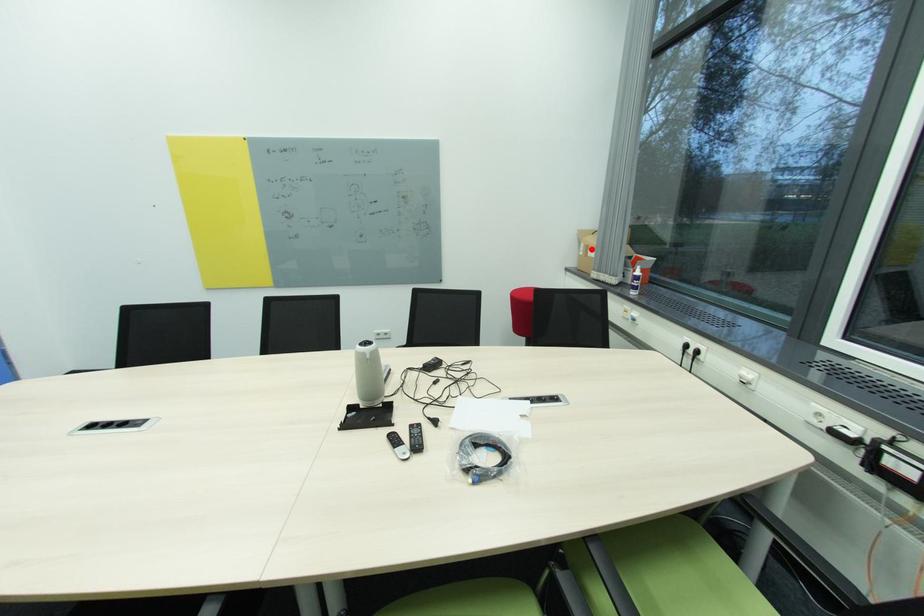
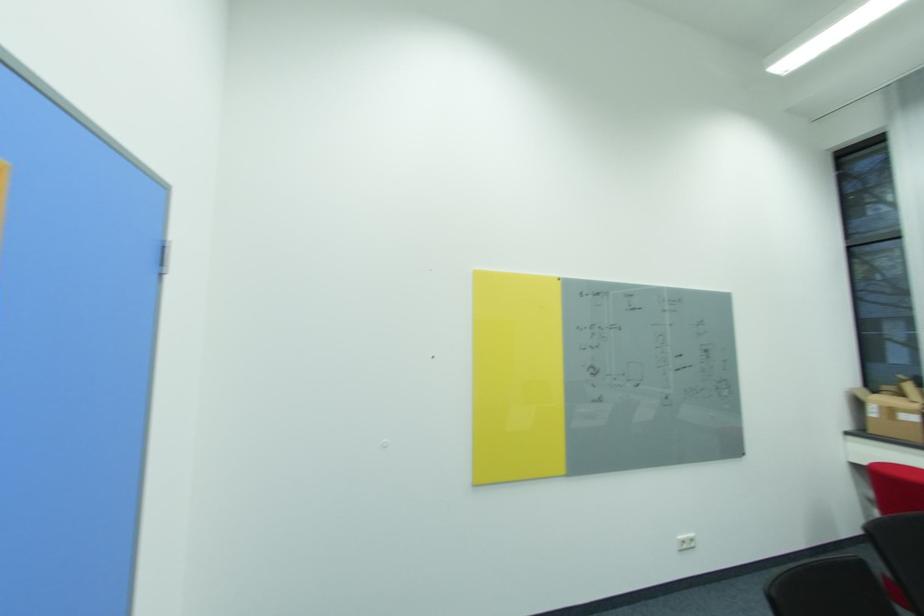
Where in the second image is the point corresponding to the highlighted location from the first image?

(895, 411)